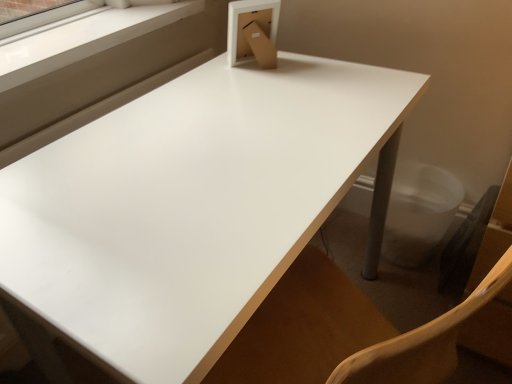
Identify the location of free space above white glossy table at center (from a real-world perspective). (228, 156).